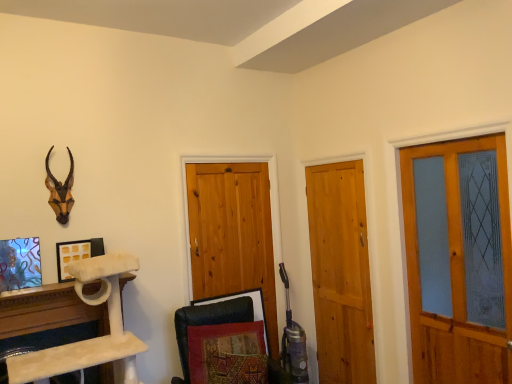
Question: Considering the relative sizes of natural wood barn door at center, which is the first barn door from left to right, and black leather swivel chair at lower center in the image provided, is natural wood barn door at center, which is the first barn door from left to right, bigger than black leather swivel chair at lower center?

Choices:
 (A) no
 (B) yes

Answer: (A)

Question: From the image's perspective, would you say natural wood barn door at center, the 2th barn door positioned from the right, is positioned over black leather swivel chair at lower center?

Choices:
 (A) no
 (B) yes

Answer: (B)

Question: From the image's perspective, is natural wood barn door at center, which is the first barn door from left to right, located beneath black leather swivel chair at lower center?

Choices:
 (A) no
 (B) yes

Answer: (A)

Question: From a real-world perspective, is natural wood barn door at center, which is the first barn door from left to right, physically below black leather swivel chair at lower center?

Choices:
 (A) yes
 (B) no

Answer: (B)

Question: Can you confirm if natural wood barn door at center, the 2th barn door positioned from the right, is positioned to the left of black leather swivel chair at lower center?

Choices:
 (A) no
 (B) yes

Answer: (B)

Question: Does natural wood barn door at center, the 2th barn door positioned from the right, have a greater width compared to black leather swivel chair at lower center?

Choices:
 (A) no
 (B) yes

Answer: (A)

Question: Is brown matte/decorative animal head at upper left shorter than white marble cat tree at lower left?

Choices:
 (A) no
 (B) yes

Answer: (B)

Question: Considering the relative positions of brown matte/decorative animal head at upper left and white marble cat tree at lower left in the image provided, is brown matte/decorative animal head at upper left to the right of white marble cat tree at lower left from the viewer's perspective?

Choices:
 (A) yes
 (B) no

Answer: (A)

Question: Is the position of brown matte/decorative animal head at upper left less distant than that of white marble cat tree at lower left?

Choices:
 (A) no
 (B) yes

Answer: (A)

Question: Does brown matte/decorative animal head at upper left touch white marble cat tree at lower left?

Choices:
 (A) no
 (B) yes

Answer: (A)

Question: Does brown matte/decorative animal head at upper left have a larger size compared to white marble cat tree at lower left?

Choices:
 (A) yes
 (B) no

Answer: (B)

Question: Is brown matte/decorative animal head at upper left facing away from white marble cat tree at lower left?

Choices:
 (A) yes
 (B) no

Answer: (B)

Question: From the image's perspective, would you say white matte picture frame at upper left, the second picture frame when ordered from left to right, is shown under matte wooden screen door at right?

Choices:
 (A) no
 (B) yes

Answer: (A)